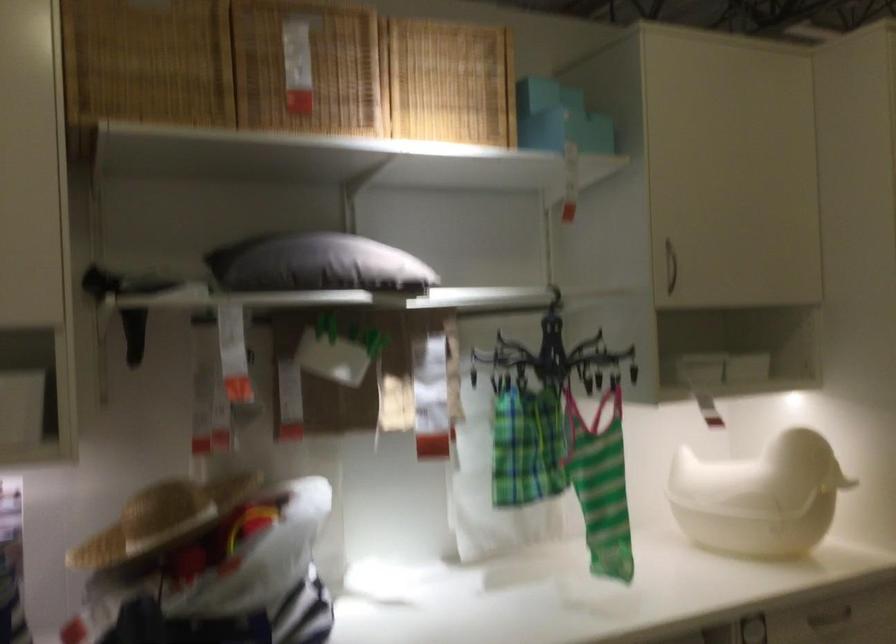
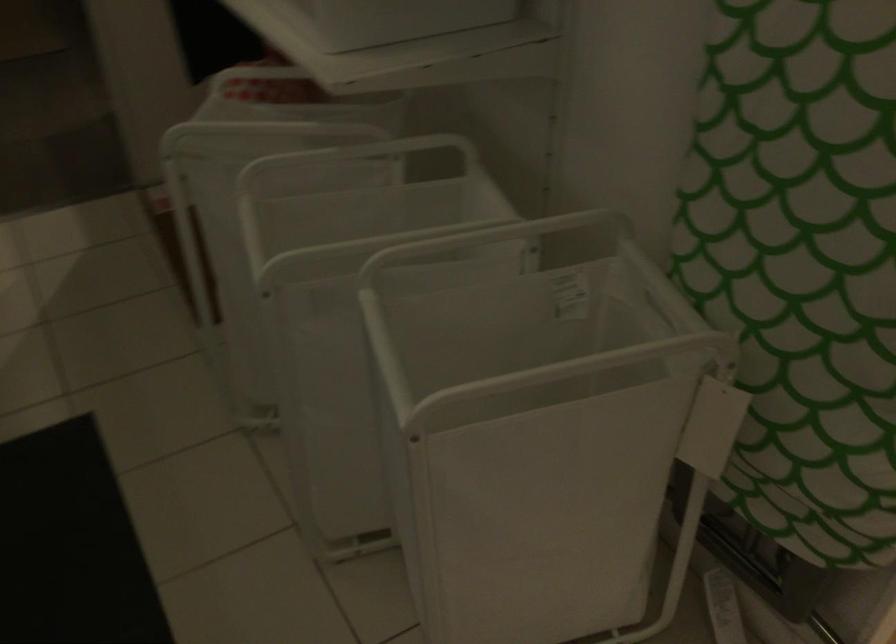
How did the camera likely rotate?

The rotation direction of the camera is right-down.